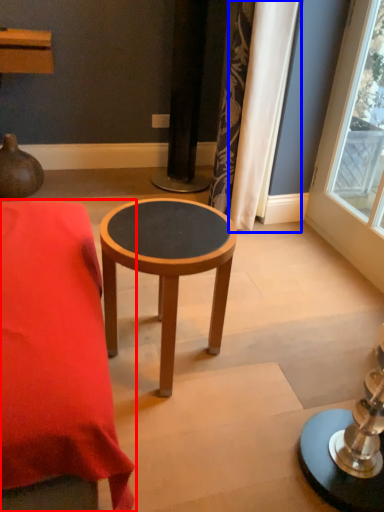
Question: Which of the following is the farthest to the observer, table (highlighted by a red box) or curtain (highlighted by a blue box)?

Choices:
 (A) table
 (B) curtain

Answer: (B)